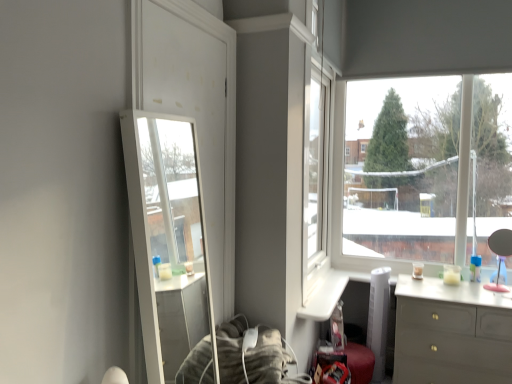
Question: Should I look upward or downward to see matte gray dresser at lower right?

Choices:
 (A) up
 (B) down

Answer: (B)

Question: From a real-world perspective, is transparent glass window at upper right positioned over clear glass mirror at left based on gravity?

Choices:
 (A) yes
 (B) no

Answer: (A)

Question: Is transparent glass window at upper right oriented towards clear glass mirror at left?

Choices:
 (A) yes
 (B) no

Answer: (A)

Question: Is clear glass mirror at left surrounded by transparent glass window at upper right?

Choices:
 (A) yes
 (B) no

Answer: (B)

Question: Is transparent glass window at upper right positioned far away from clear glass mirror at left?

Choices:
 (A) yes
 (B) no

Answer: (A)

Question: Can you confirm if transparent glass window at upper right is wider than clear glass mirror at left?

Choices:
 (A) no
 (B) yes

Answer: (B)

Question: Is transparent glass window at upper right to the right of clear glass mirror at left from the viewer's perspective?

Choices:
 (A) no
 (B) yes

Answer: (B)

Question: From the image's perspective, does clear glass mirror at left appear lower than transparent glass window at upper right?

Choices:
 (A) no
 (B) yes

Answer: (B)

Question: Considering the relative positions of clear glass mirror at left and transparent glass window at upper right in the image provided, is clear glass mirror at left to the right of transparent glass window at upper right from the viewer's perspective?

Choices:
 (A) yes
 (B) no

Answer: (B)

Question: Is clear glass mirror at left facing away from transparent glass window at upper right?

Choices:
 (A) yes
 (B) no

Answer: (B)

Question: Is clear glass mirror at left touching transparent glass window at upper right?

Choices:
 (A) yes
 (B) no

Answer: (B)

Question: Can you confirm if clear glass mirror at left is thinner than transparent glass window at upper right?

Choices:
 (A) yes
 (B) no

Answer: (A)

Question: Is the position of clear glass mirror at left less distant than that of transparent glass window at upper right?

Choices:
 (A) no
 (B) yes

Answer: (B)

Question: From a real-world perspective, is clear glass mirror at left on matte gray dresser at lower right?

Choices:
 (A) yes
 (B) no

Answer: (A)